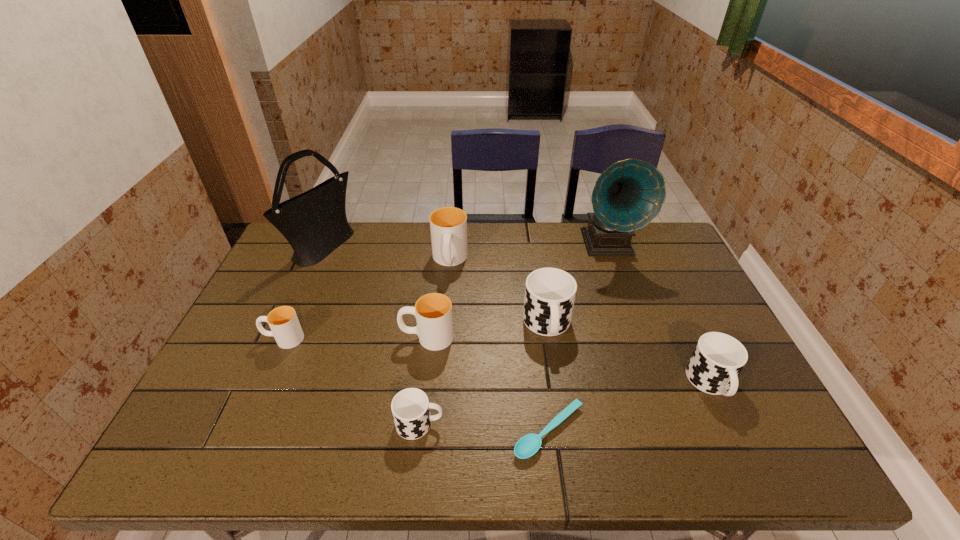
Identify the location of vacant space at the far left corner. (284, 245).

This screenshot has height=540, width=960. I want to click on free space at the near left corner of the desktop, so click(230, 455).

Where is `vacant region at the far right corner of the desktop`? The width and height of the screenshot is (960, 540). vacant region at the far right corner of the desktop is located at coordinates (659, 233).

This screenshot has height=540, width=960. What are the coordinates of `blank space at the near right corner` in the screenshot? It's located at (785, 436).

The image size is (960, 540). In order to click on free spot between the fifth cup from left to right and the biggest yellow cup in this screenshot , I will do `click(498, 293)`.

Find the location of `vacant space in between the shoulder bag and the farthest cup`. vacant space in between the shoulder bag and the farthest cup is located at coordinates (387, 254).

At what (x,y) coordinates should I click in order to perform the action: click on vacant space that is in between the shortest object and the leftmost black cup. Please return your answer as a coordinate pair (x, y). This screenshot has height=540, width=960. Looking at the image, I should click on (485, 428).

I want to click on vacant region between the smallest yellow cup and the leftmost black cup, so click(x=351, y=381).

Where is `unoccupied area between the phonograph_record and the farthest yellow cup`? unoccupied area between the phonograph_record and the farthest yellow cup is located at coordinates (529, 253).

Where is `unoccupied area between the phonograph_record and the second black cup from left to right`? unoccupied area between the phonograph_record and the second black cup from left to right is located at coordinates (x=578, y=285).